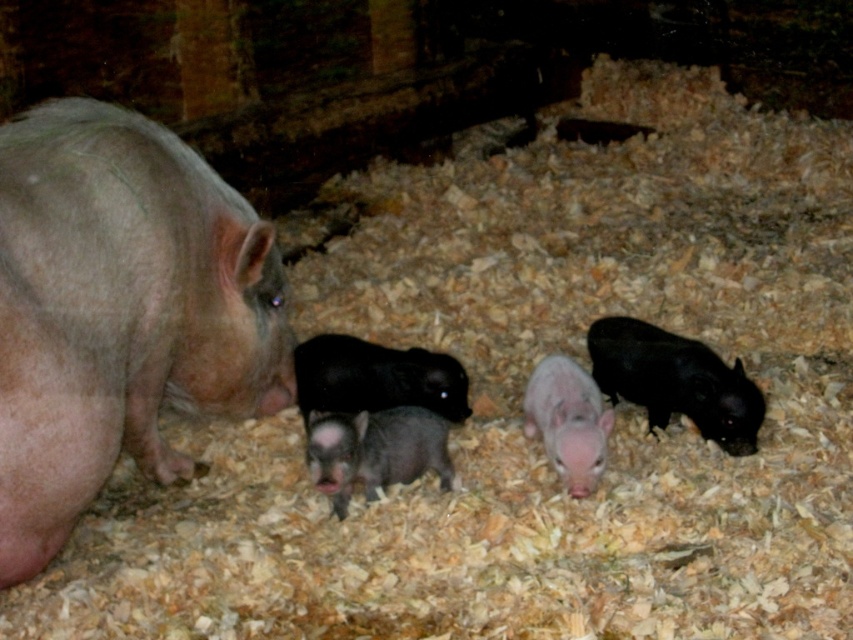
You are a farmer checking the pigs in the barn. You see the pink matte pig at left and the black matte piglet at right. Which one has a larger body width?

The pink matte pig at left might be wider than black matte piglet at right, so the pink matte pig at left likely has a larger body width.

You are a farmer who wants to separate the pink matte pig at left and the black matte piglet at right into two different pens. The minimum distance between the pens should be 5 feet. Based on their current positions, do you think the pens can be placed far enough apart?

The distance between the pink matte pig at left and the black matte piglet at right is 4.44 feet, which is less than the required 5 feet. Therefore, the pens cannot be placed far enough apart based on their current positions.